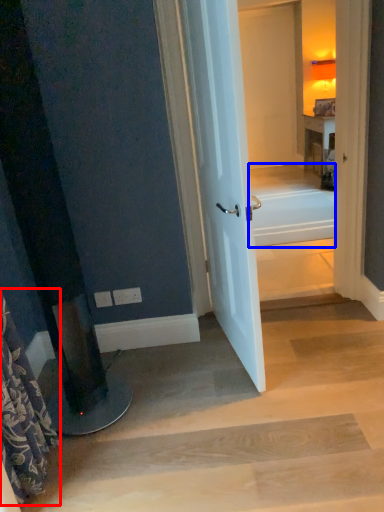
Question: Among these objects, which one is farthest to the camera, shower curtain (highlighted by a red box) or bath (highlighted by a blue box)?

Choices:
 (A) shower curtain
 (B) bath

Answer: (B)